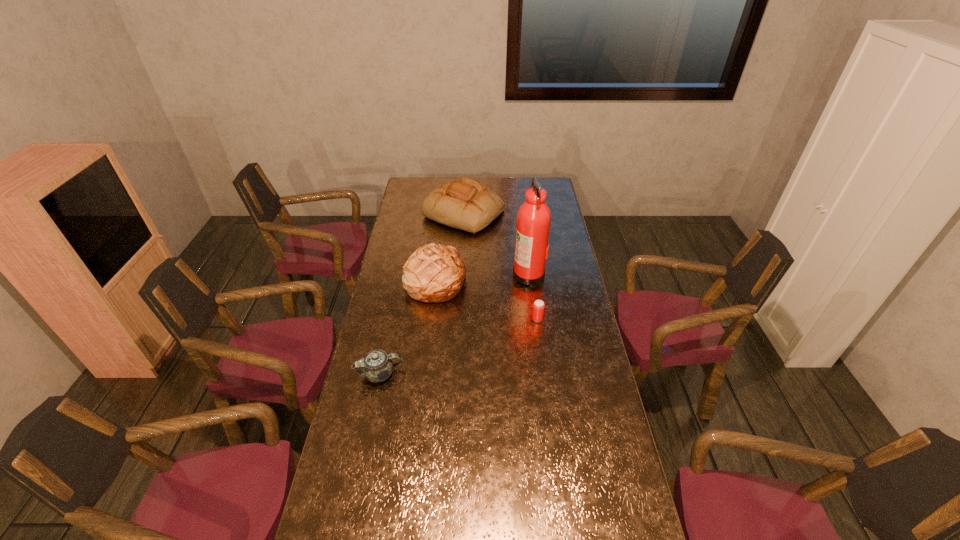
This screenshot has height=540, width=960. Find the location of `free spot located on the back of the nearer bread`. free spot located on the back of the nearer bread is located at coordinates (441, 236).

Where is `vacant area situated from the spout of the chinaware`? The width and height of the screenshot is (960, 540). vacant area situated from the spout of the chinaware is located at coordinates (482, 374).

Identify the location of vacant region located 0.230m on the front of the beer can. The image size is (960, 540). (544, 372).

This screenshot has width=960, height=540. I want to click on object that is at the far edge, so click(x=466, y=204).

Identify the location of chinaware that is positioned at the left edge. The width and height of the screenshot is (960, 540). (376, 366).

Where is `object that is at the right edge`? object that is at the right edge is located at coordinates (533, 222).

This screenshot has height=540, width=960. In order to click on object that is at the far left corner in this screenshot , I will do `click(466, 204)`.

Where is `blank space at the left edge of the desktop`? This screenshot has width=960, height=540. blank space at the left edge of the desktop is located at coordinates (403, 305).

In the image, there is a desktop. At what (x,y) coordinates should I click in order to perform the action: click on free region at the right edge. Please return your answer as a coordinate pair (x, y). Image resolution: width=960 pixels, height=540 pixels. Looking at the image, I should click on (558, 249).

The height and width of the screenshot is (540, 960). I want to click on empty space between the shortest object and the farthest object, so click(500, 266).